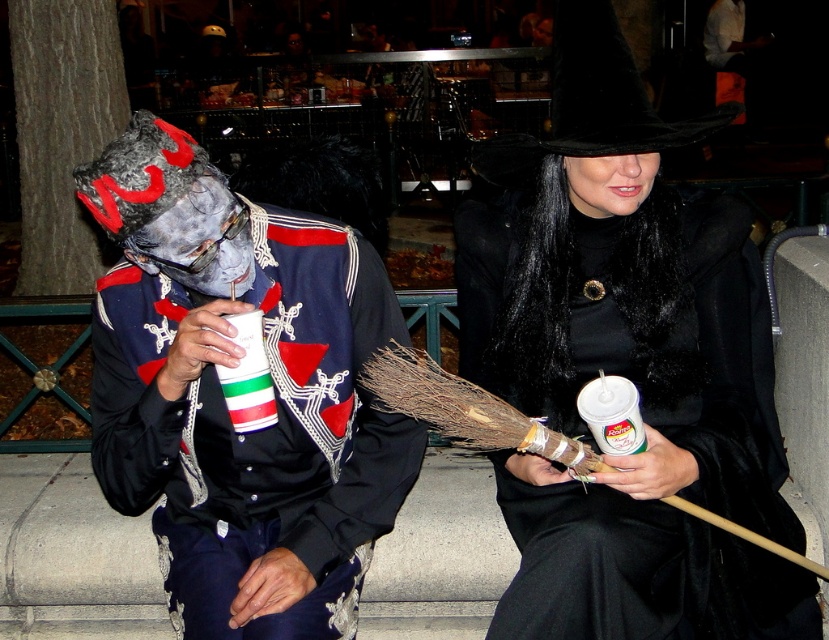
You are a photographer trying to capture a closeup of the black fur coat at center. Based on the coordinates provided, where should you position your camera to ensure the coat is centered in the frame?

The black fur coat at center is located at coordinates point (626, 365), so positioning the camera to center the frame at those coordinates will ensure the coat is centered.

You are taking a photo of two people sitting on a bench. There are two points marked in the image. The first point is at coordinates point [696,534] and the second point is at point [233,280]. If you want to focus on the point closer to you, which coordinate should you choose?

You should choose point [233,280] because it is closer to you than point [696,534].

Based on the photo, you are a photographer trying to capture a Halloween photo of the two people in the image. You want to ensure the black fur coat at center and the matte black costume at center are both visible in the frame. Based on their positions, which object should you position closer to the left side of the camera to include both in the shot?

The matte black costume at center should be positioned closer to the left side of the camera because the black fur coat at center is to the right of the matte black costume at center, so moving the matte black costume leftward would help both fit within the frame.